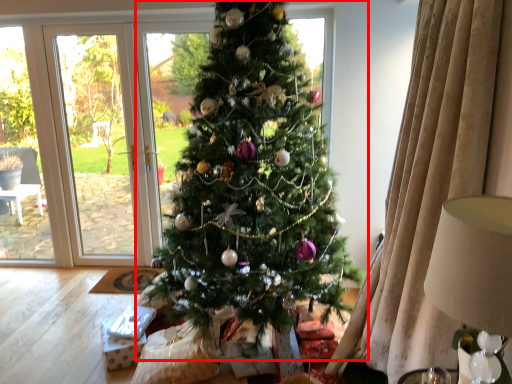
Question: From the image's perspective, what is the correct spatial relationship of christmas tree (annotated by the red box) in relation to lamp?

Choices:
 (A) above
 (B) below

Answer: (A)